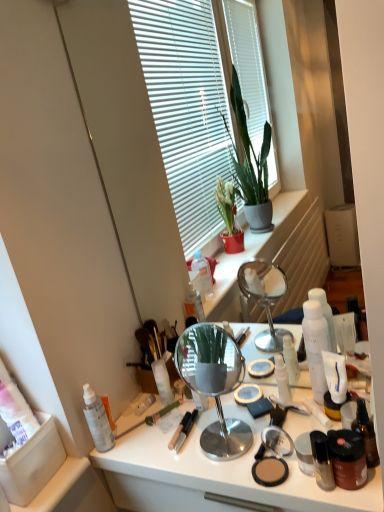
Find the location of a particular element. The height and width of the screenshot is (512, 384). free space that is in between transparent plastic spray bottle at left, the 7th toiletry in the right-to-left sequence, and matte brown jar at lower right, which appears as the 6th toiletry when viewed from the left is located at coordinates tap(192, 459).